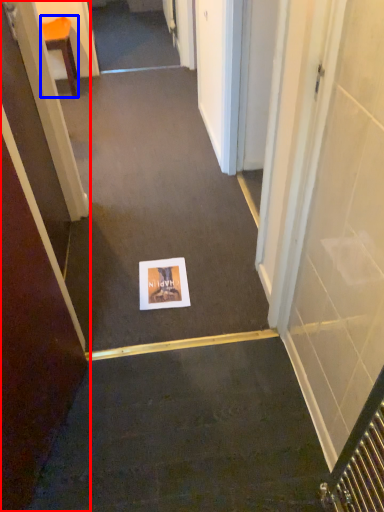
Question: Which object is closer to the camera taking this photo, door (highlighted by a red box) or furniture (highlighted by a blue box)?

Choices:
 (A) door
 (B) furniture

Answer: (A)